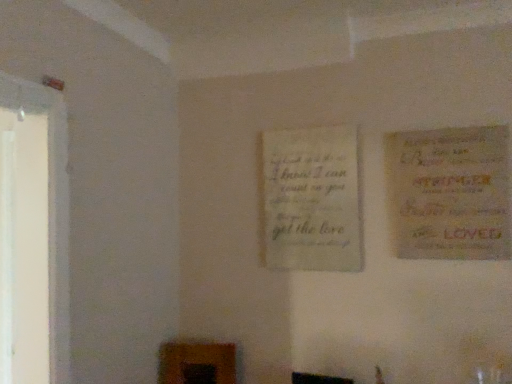
Question: Is light beige paper at center, which is counted as the second poster, starting from the front, outside yellow paper poster at right, which ranks as the second poster in back-to-front order?

Choices:
 (A) no
 (B) yes

Answer: (B)

Question: From a real-world perspective, is light beige paper at center, which is counted as the second poster, starting from the front, positioned under yellow paper poster at right, marked as the 2th poster in a left-to-right arrangement, based on gravity?

Choices:
 (A) no
 (B) yes

Answer: (B)

Question: Considering the relative sizes of light beige paper at center, the 2th poster in the right-to-left sequence, and yellow paper poster at right, acting as the first poster starting from the front, in the image provided, is light beige paper at center, the 2th poster in the right-to-left sequence, smaller than yellow paper poster at right, acting as the first poster starting from the front,?

Choices:
 (A) yes
 (B) no

Answer: (A)

Question: Is light beige paper at center, the first poster from the left, facing away from yellow paper poster at right, marked as the 2th poster in a left-to-right arrangement?

Choices:
 (A) yes
 (B) no

Answer: (B)

Question: Does light beige paper at center, the 2th poster in the right-to-left sequence, appear on the right side of yellow paper poster at right, acting as the first poster starting from the front?

Choices:
 (A) no
 (B) yes

Answer: (A)

Question: Does light beige paper at center, which is counted as the second poster, starting from the front, have a lesser height compared to yellow paper poster at right, which ranks as the second poster in back-to-front order?

Choices:
 (A) yes
 (B) no

Answer: (B)

Question: Can you confirm if yellow paper poster at right, which appears as the 1th poster when viewed from the right, is positioned to the left of light beige paper at center, the 2th poster in the right-to-left sequence?

Choices:
 (A) yes
 (B) no

Answer: (B)

Question: Is yellow paper poster at right, marked as the 2th poster in a left-to-right arrangement, oriented away from light beige paper at center, the first poster from the left?

Choices:
 (A) no
 (B) yes

Answer: (A)

Question: From the image's perspective, is yellow paper poster at right, which appears as the 1th poster when viewed from the right, located above light beige paper at center, which is counted as the second poster, starting from the front?

Choices:
 (A) yes
 (B) no

Answer: (A)

Question: Considering the relative positions of yellow paper poster at right, which ranks as the second poster in back-to-front order, and light beige paper at center, the first poster from the left, in the image provided, is yellow paper poster at right, which ranks as the second poster in back-to-front order, behind light beige paper at center, the first poster from the left,?

Choices:
 (A) no
 (B) yes

Answer: (A)

Question: Does yellow paper poster at right, acting as the first poster starting from the front, lie in front of light beige paper at center, which is counted as the second poster, starting from the front?

Choices:
 (A) no
 (B) yes

Answer: (B)

Question: Is yellow paper poster at right, acting as the first poster starting from the front, aimed at light beige paper at center, which is counted as the second poster, starting from the front?

Choices:
 (A) no
 (B) yes

Answer: (A)

Question: Is light beige paper at center, marked as the first poster in a back-to-front arrangement, in front of or behind yellow paper poster at right, which appears as the 1th poster when viewed from the right, in the image?

Choices:
 (A) front
 (B) behind

Answer: (B)